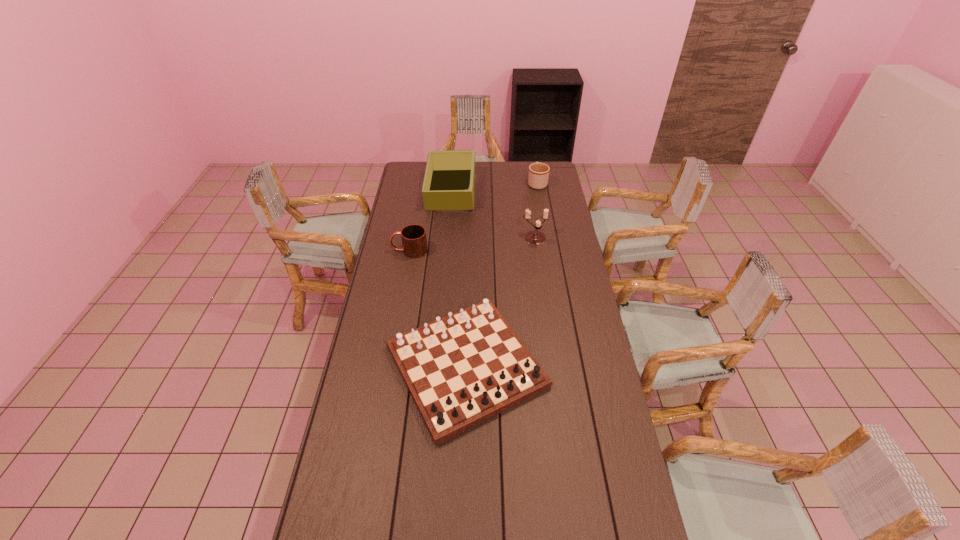
The width and height of the screenshot is (960, 540). Identify the location of mug at the far edge. (x=538, y=176).

Where is `box located at the left edge`? This screenshot has height=540, width=960. box located at the left edge is located at coordinates (449, 183).

Locate an element on the screen. The width and height of the screenshot is (960, 540). mug positioned at the left edge is located at coordinates (414, 242).

Where is `chessboard present at the left edge`? chessboard present at the left edge is located at coordinates (462, 369).

This screenshot has width=960, height=540. Identify the location of candle holder that is positioned at the right edge. (535, 237).

Where is `mug located in the right edge section of the desktop`? The width and height of the screenshot is (960, 540). mug located in the right edge section of the desktop is located at coordinates [x=538, y=176].

Where is `object at the far left corner`? object at the far left corner is located at coordinates (449, 183).

The image size is (960, 540). I want to click on object that is at the far right corner, so click(538, 176).

Locate an element on the screen. The height and width of the screenshot is (540, 960). vacant space at the left edge of the desktop is located at coordinates (379, 368).

Where is `free region at the right edge of the desktop`? The image size is (960, 540). free region at the right edge of the desktop is located at coordinates (585, 365).